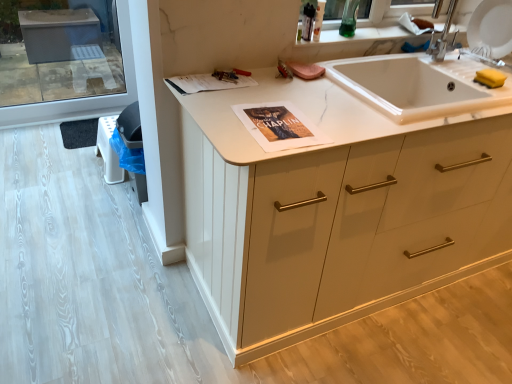
Identify the location of vacant space to the right of matte paper magazine at upper center. (251, 87).